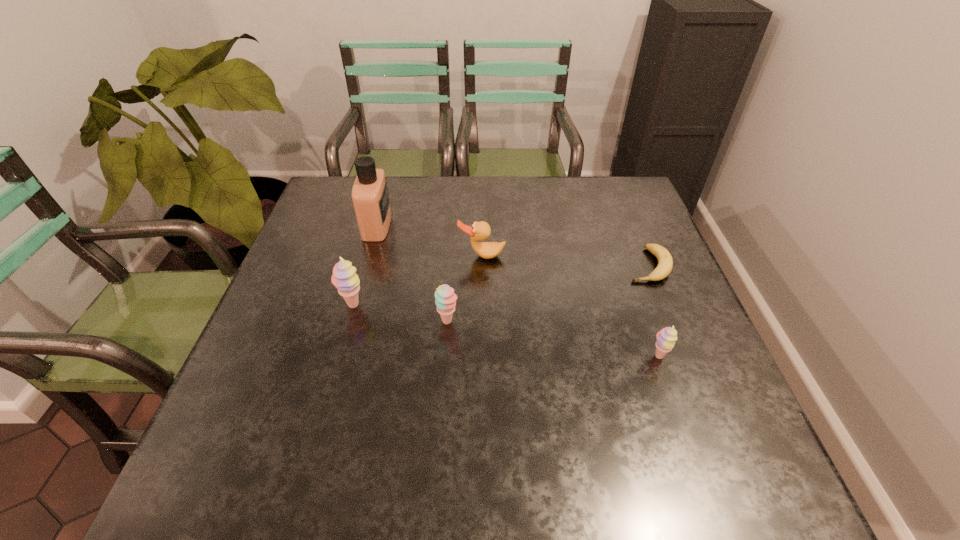
Locate an element on the screen. Image resolution: width=960 pixels, height=540 pixels. vacant area in the image that satisfies the following two spatial constraints: 1. on the front label of the tallest object; 2. on the back side of the second shortest sherbert is located at coordinates (350, 321).

Identify the location of free region that satisfies the following two spatial constraints: 1. on the front label of the farthest object; 2. on the front side of the leftmost sherbert. The height and width of the screenshot is (540, 960). (355, 306).

Find the location of a particular element. This screenshot has width=960, height=540. free space that satisfies the following two spatial constraints: 1. on the back side of the shortest sherbert; 2. on the front label of the tallest object is located at coordinates (612, 225).

Locate an element on the screen. This screenshot has width=960, height=540. vacant point that satisfies the following two spatial constraints: 1. on the front label of the shortest object; 2. on the right side of the perfume is located at coordinates (366, 265).

This screenshot has height=540, width=960. I want to click on free spot that satisfies the following two spatial constraints: 1. on the front label of the farthest object; 2. on the back side of the rightmost sherbert, so click(341, 357).

Identify the location of vacant position in the image that satisfies the following two spatial constraints: 1. on the beak of the nearest object; 2. on the right side of the duck. This screenshot has height=540, width=960. (482, 357).

This screenshot has height=540, width=960. Find the location of `vacant space that satisfies the following two spatial constraints: 1. on the beak of the rightmost sherbert; 2. on the right side of the duck`. vacant space that satisfies the following two spatial constraints: 1. on the beak of the rightmost sherbert; 2. on the right side of the duck is located at coordinates (482, 357).